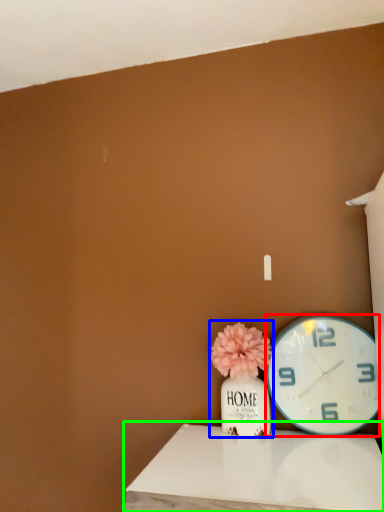
Question: Which object is positioned farthest from wall clock (highlighted by a red box)? Select from floral arrangement (highlighted by a blue box) and table (highlighted by a green box).

Choices:
 (A) floral arrangement
 (B) table

Answer: (B)